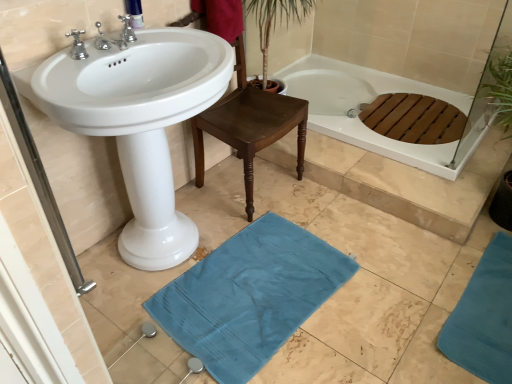
You are a GUI agent. You are given a task and a screenshot of the screen. Output one action in this format:
    pyautogui.click(x=<x>, y=<y>)
    Task: Click on the free space above blue fabric bath mat at lower center, the second bath mat viewed from the right (from a real-world perspective)
    
    Given the screenshot: What is the action you would take?
    pyautogui.click(x=253, y=288)